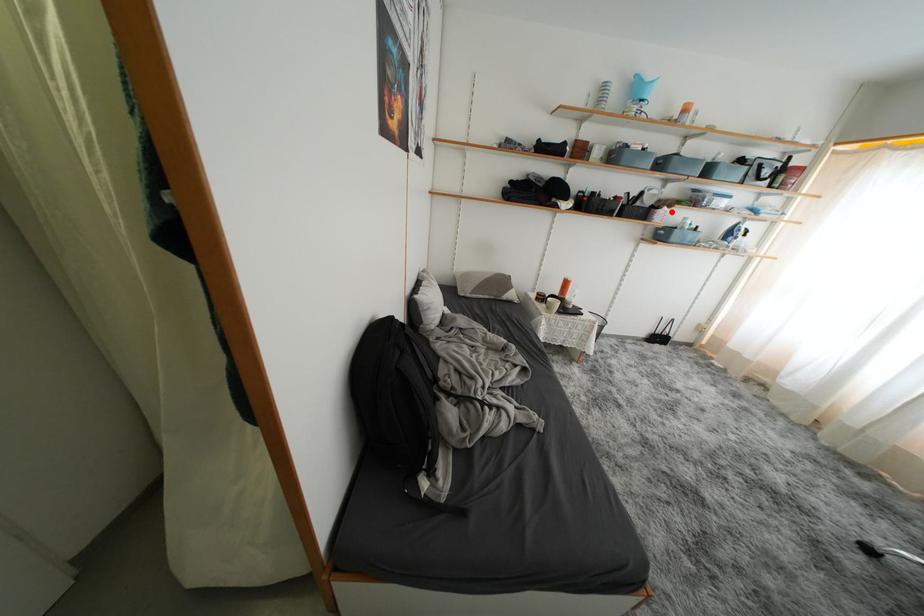
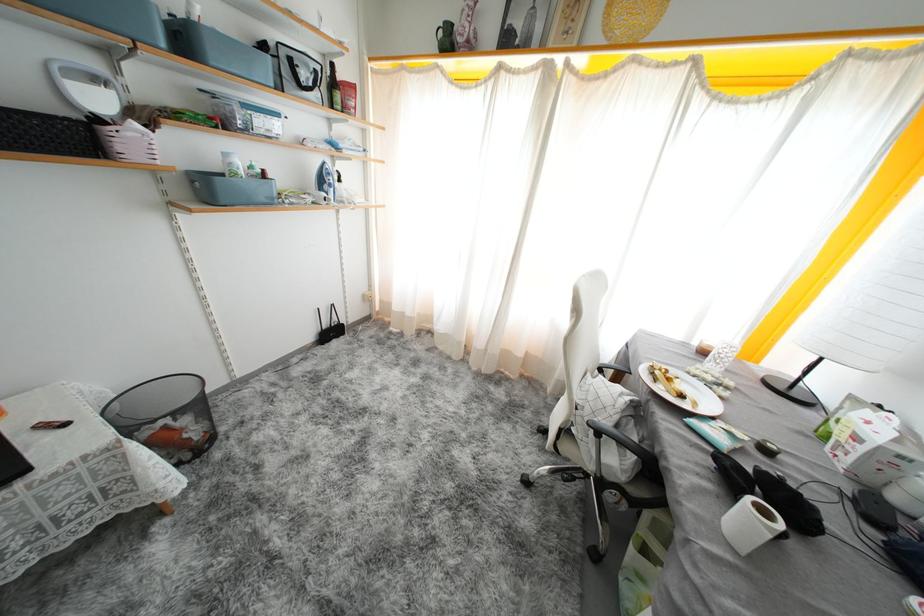
Question: I am providing you with two images of the same scene from different viewpoints. A red point is marked on the first image. Is the red point's position out of view in image 2?

Choices:
 (A) Yes
 (B) No

Answer: (B)